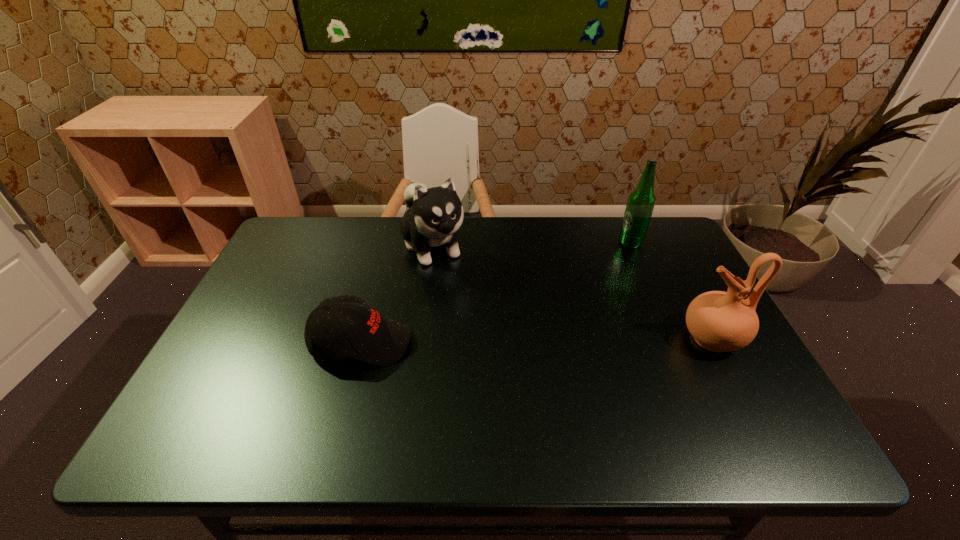
Where is `free space on the desktop that is between the shortest object and the pottery and is positioned on the label of the beer bottle`? free space on the desktop that is between the shortest object and the pottery and is positioned on the label of the beer bottle is located at coordinates (568, 340).

Image resolution: width=960 pixels, height=540 pixels. Identify the location of free space on the desktop that is between the shortest object and the pottery and is positioned at the face of the puppy. (490, 341).